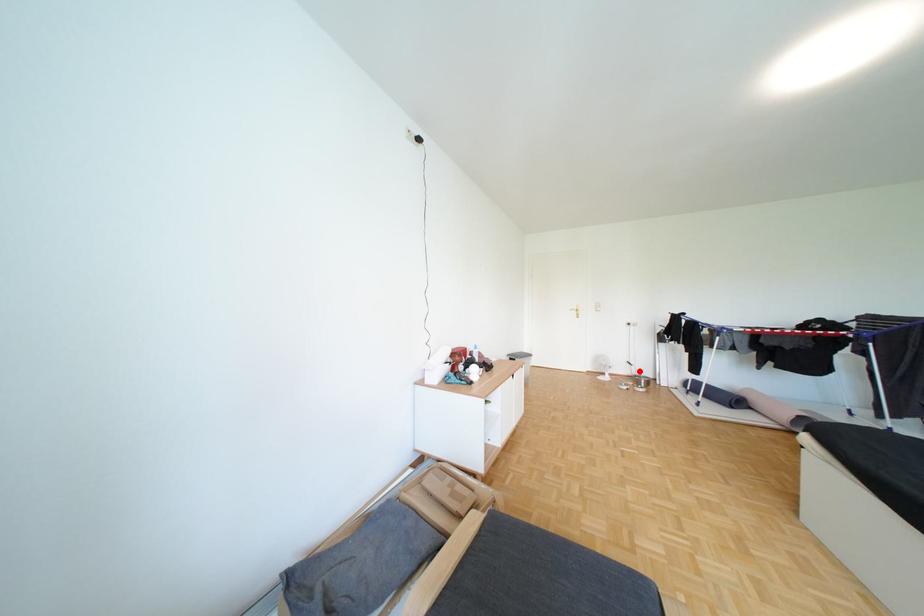
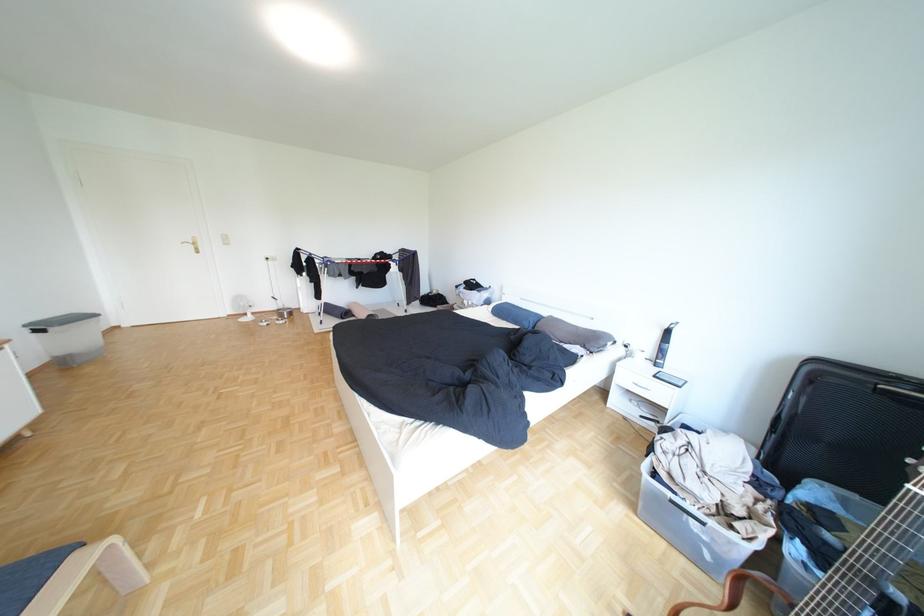
Question: I am providing you with two images of the same scene from different viewpoints. Given a red point in image1, look at the same physical point in image2. Is it:

Choices:
 (A) Closer to the viewpoint
 (B) Farther from the viewpoint

Answer: (A)